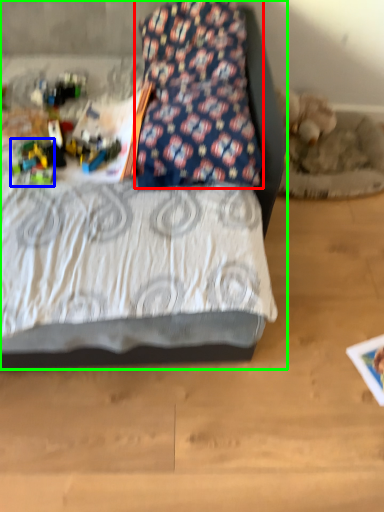
Question: Estimate the real-world distances between objects in this image. Which object is farther from pillow (highlighted by a red box), toy (highlighted by a blue box) or bed (highlighted by a green box)?

Choices:
 (A) toy
 (B) bed

Answer: (B)